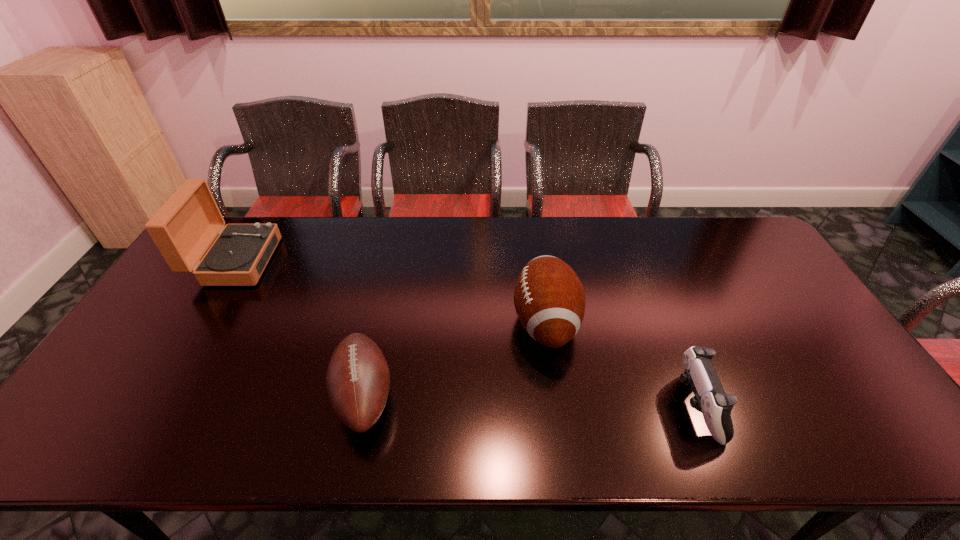
I want to click on vacant region at the far edge of the desktop, so click(x=682, y=234).

Where is `free space at the near edge of the desktop`? The height and width of the screenshot is (540, 960). free space at the near edge of the desktop is located at coordinates (134, 447).

Where is `free region at the left edge`? This screenshot has width=960, height=540. free region at the left edge is located at coordinates (117, 356).

You are a GUI agent. You are given a task and a screenshot of the screen. Output one action in this format:
    pyautogui.click(x=<x>, y=<y>)
    Task: Click on the vacant space that's between the phonograph record and the third shortest object
    The height and width of the screenshot is (540, 960).
    Given the screenshot: What is the action you would take?
    pyautogui.click(x=391, y=292)

You are a GUI agent. You are given a task and a screenshot of the screen. Output one action in this format:
    pyautogui.click(x=<x>, y=<y>)
    Task: Click on the vacant space in between the rightmost object and the left football (American)
    Image resolution: width=960 pixels, height=540 pixels.
    Given the screenshot: What is the action you would take?
    pyautogui.click(x=530, y=401)

Where is `empty location between the left football (American) and the control`? The width and height of the screenshot is (960, 540). empty location between the left football (American) and the control is located at coordinates (530, 401).

Where is `vacant space in between the third object from left to right and the phonograph record`? The image size is (960, 540). vacant space in between the third object from left to right and the phonograph record is located at coordinates (391, 292).

You are a GUI agent. You are given a task and a screenshot of the screen. Output one action in this format:
    pyautogui.click(x=<x>, y=<y>)
    Task: Click on the vacant area between the right football (American) and the shorter football (American)
    
    Given the screenshot: What is the action you would take?
    pyautogui.click(x=455, y=359)

The image size is (960, 540). I want to click on vacant space that is in between the second object from left to right and the right football (American), so pyautogui.click(x=455, y=359).

Identify the location of free spot between the left football (American) and the control. This screenshot has width=960, height=540. (530, 401).